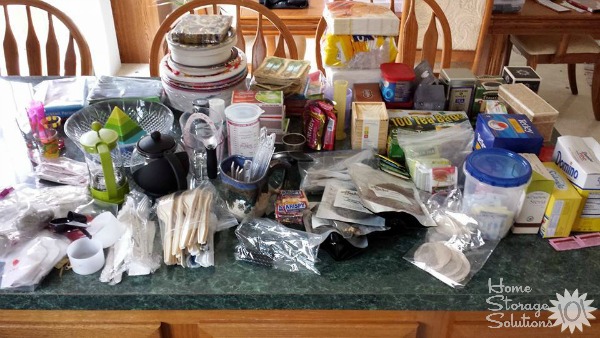
The height and width of the screenshot is (338, 600). In order to click on chair in this screenshot , I will do `click(570, 53)`.